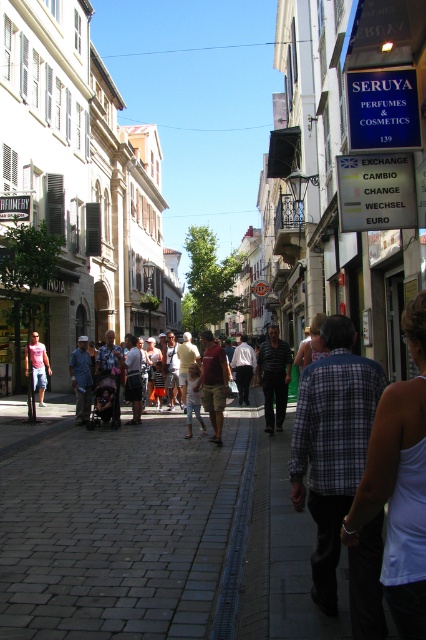
Does point (49, 444) come closer to viewer compared to point (25, 374)?

Yes, point (49, 444) is closer to viewer.

Is gray cobblestone pavement at center above matte pink shirt at left?

Incorrect, gray cobblestone pavement at center is not positioned above matte pink shirt at left.

This screenshot has width=426, height=640. What do you see at coordinates (126, 532) in the screenshot?
I see `gray cobblestone pavement at center` at bounding box center [126, 532].

What are the coordinates of `gray cobblestone pavement at center` in the screenshot? It's located at (126, 532).